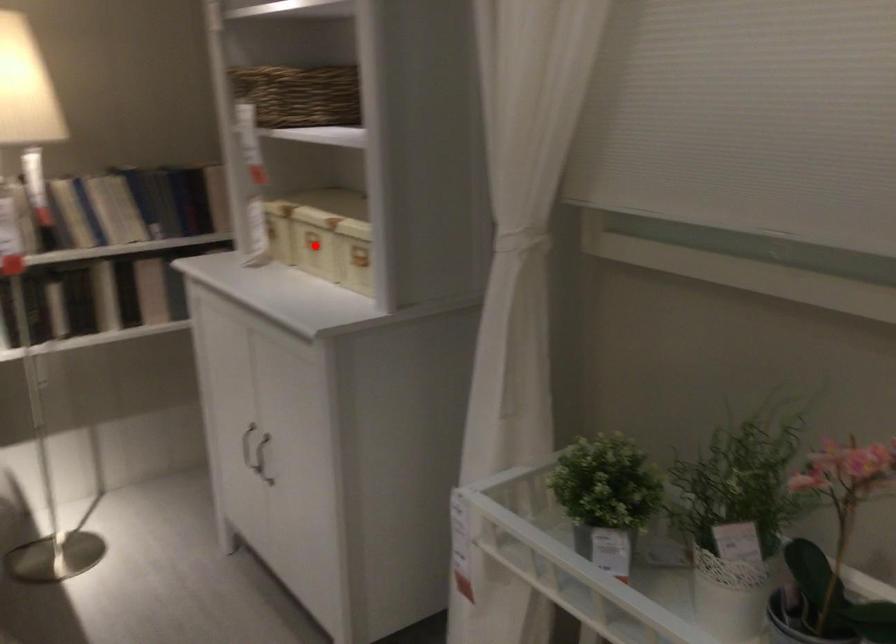
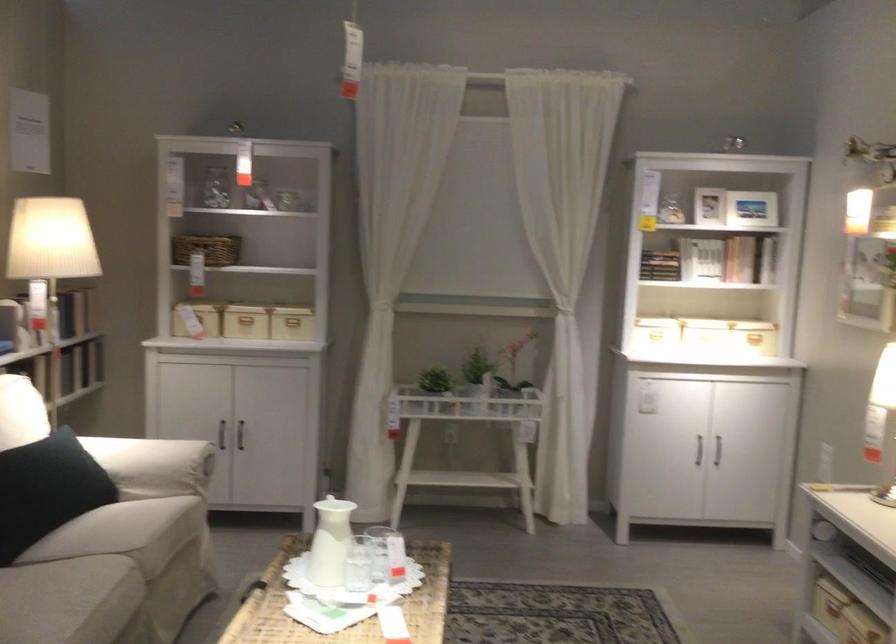
In the second image, find the point that corresponds to the highlighted location in the first image.

(245, 319)